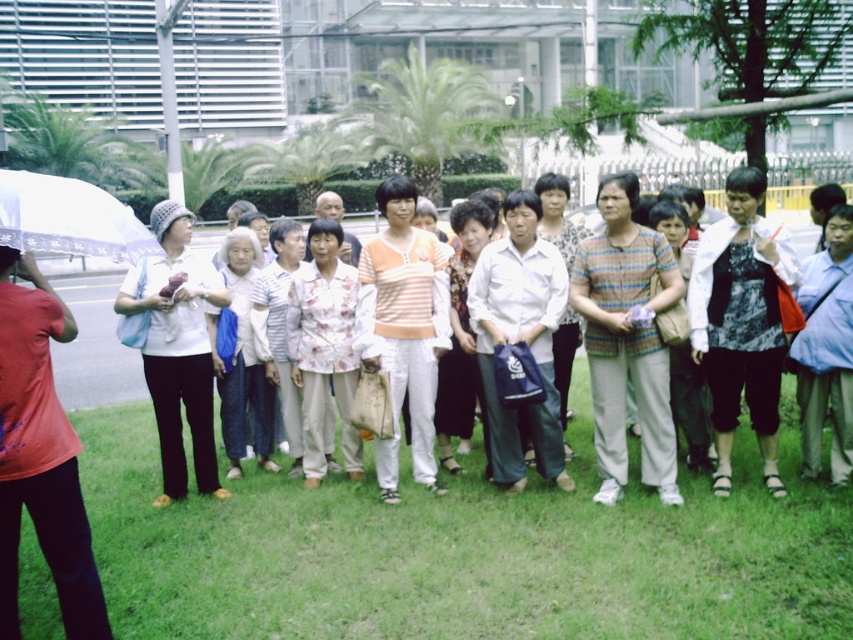
Question: Which of the following is the farthest from the observer?

Choices:
 (A) (64, 212)
 (B) (804, 390)
 (C) (766, 298)
 (D) (167, 448)

Answer: (D)

Question: Does green grass at lower center appear over matte red t-shirt at left?

Choices:
 (A) no
 (B) yes

Answer: (A)

Question: Based on their relative distances, which object is farther from the light blue shirt at center?

Choices:
 (A) white matte shirt at center
 (B) matte red t-shirt at left
 (C) green grass at lower center

Answer: (B)

Question: Is matte red t-shirt at left to the right of matte white shirt at center from the viewer's perspective?

Choices:
 (A) no
 (B) yes

Answer: (A)

Question: Is matte red t-shirt at left smaller than white matte shirt at center?

Choices:
 (A) yes
 (B) no

Answer: (A)

Question: Based on their relative distances, which object is nearer to the printed fabric blouse at center?

Choices:
 (A) white fabric umbrella at left
 (B) white matte shirt at center
 (C) light blue shirt at center

Answer: (C)